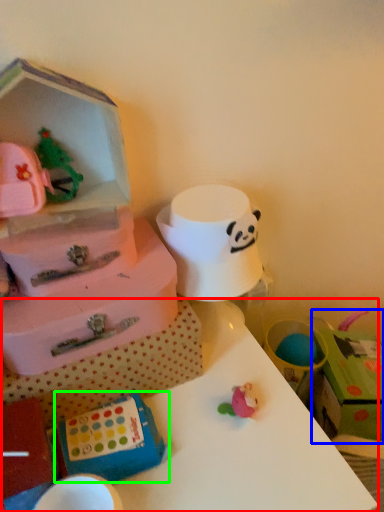
Question: Which is farther away from table (highlighted by a red box)? storage box (highlighted by a blue box) or box (highlighted by a green box)?

Choices:
 (A) storage box
 (B) box

Answer: (A)